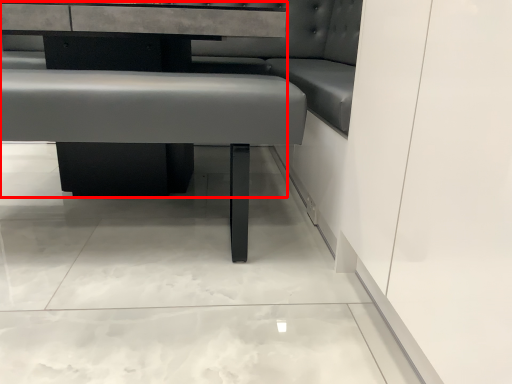
Question: Where is table (annotated by the red box) located in relation to vanity in the image?

Choices:
 (A) left
 (B) right

Answer: (A)